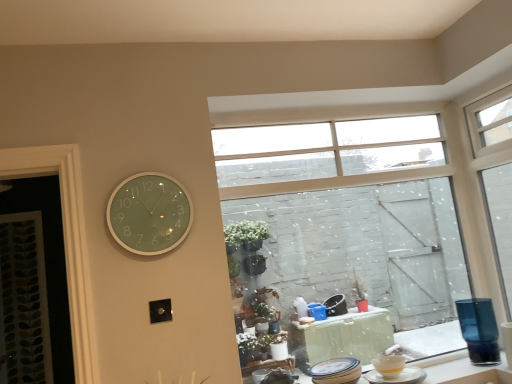
Question: In terms of width, does green glass clock at upper left look wider or thinner when compared to clear glass window at upper right, the 1th window viewed from the right?

Choices:
 (A) wide
 (B) thin

Answer: (B)

Question: From a real-world perspective, relative to clear glass window at upper right, the second window from the left, is green glass clock at upper left vertically above or below?

Choices:
 (A) below
 (B) above

Answer: (B)

Question: Which object is the closest to the green glass clock at upper left?

Choices:
 (A) transparent blue glass at right
 (B) yellow glossy cup at lower right, arranged as the third tableware when viewed from the left
 (C) clear glass window at upper center, which appears as the 1th window when viewed from the left
 (D) white ceramic plate at lower right, placed as the 3th tableware when sorted from right to left
 (E) clear glass window at upper right, the second window from the left

Answer: (D)

Question: Which object is positioned closest to the green glass clock at upper left?

Choices:
 (A) transparent blue glass at right
 (B) clear glass window at upper center, which appears as the 1th window when viewed from the left
 (C) yellow matte bowl at lower right, marked as the second tableware in a left-to-right arrangement
 (D) white ceramic plate at lower right, placed as the 3th tableware when sorted from right to left
 (E) yellow glossy cup at lower right, placed as the first tableware when sorted from right to left

Answer: (D)